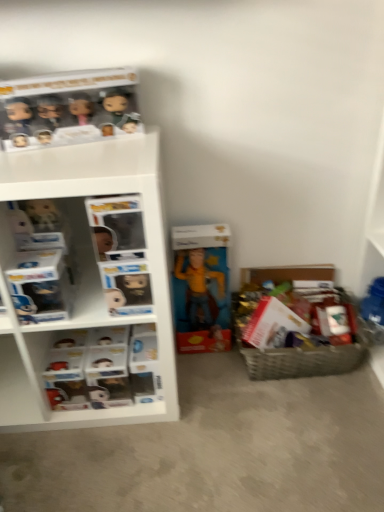
Question: Considering the relative sizes of matte black figurines at upper left and white plastic shelves at left in the image provided, is matte black figurines at upper left smaller than white plastic shelves at left?

Choices:
 (A) yes
 (B) no

Answer: (A)

Question: Considering the relative sizes of matte black figurines at upper left and white plastic shelves at left in the image provided, is matte black figurines at upper left shorter than white plastic shelves at left?

Choices:
 (A) yes
 (B) no

Answer: (A)

Question: Is matte black figurines at upper left aimed at white plastic shelves at left?

Choices:
 (A) yes
 (B) no

Answer: (B)

Question: Does matte black figurines at upper left appear on the right side of white plastic shelves at left?

Choices:
 (A) no
 (B) yes

Answer: (A)

Question: Can you confirm if matte black figurines at upper left is thinner than white plastic shelves at left?

Choices:
 (A) no
 (B) yes

Answer: (B)

Question: Based on their positions, is matte yellow action figure at center located to the left or right of matte black figurines at upper left?

Choices:
 (A) left
 (B) right

Answer: (B)

Question: Considering the positions of matte yellow action figure at center and matte black figurines at upper left in the image, is matte yellow action figure at center taller or shorter than matte black figurines at upper left?

Choices:
 (A) short
 (B) tall

Answer: (B)

Question: From a real-world perspective, is matte yellow action figure at center above or below matte black figurines at upper left?

Choices:
 (A) above
 (B) below

Answer: (B)

Question: Considering their positions, is matte yellow action figure at center located in front of or behind matte black figurines at upper left?

Choices:
 (A) front
 (B) behind

Answer: (B)

Question: Is white plastic shelves at left inside the boundaries of matte yellow action figure at center, or outside?

Choices:
 (A) inside
 (B) outside

Answer: (B)

Question: From their relative heights in the image, would you say white plastic shelves at left is taller or shorter than matte yellow action figure at center?

Choices:
 (A) short
 (B) tall

Answer: (A)

Question: Is point (62, 407) closer or farther from the camera than point (188, 294)?

Choices:
 (A) closer
 (B) farther

Answer: (A)

Question: Considering their positions, is white plastic shelves at left located in front of or behind matte yellow action figure at center?

Choices:
 (A) front
 (B) behind

Answer: (A)

Question: Is white plastic shelf at left in front of or behind white plastic shelves at left in the image?

Choices:
 (A) front
 (B) behind

Answer: (A)

Question: Considering the positions of white plastic shelf at left and white plastic shelves at left in the image, is white plastic shelf at left wider or thinner than white plastic shelves at left?

Choices:
 (A) thin
 (B) wide

Answer: (B)